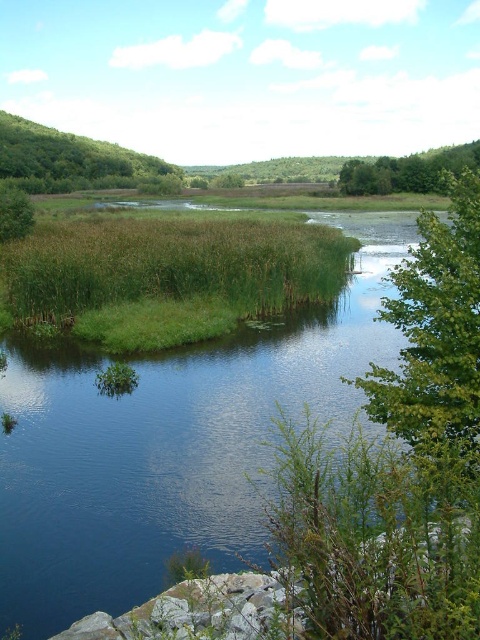
You are standing at the lower part of the image near the rocky edge. You see two points, point (469, 312) and point (357, 170). Which point is closer to you?

Point (469, 312) is closer to you because it is in front of point (357, 170).